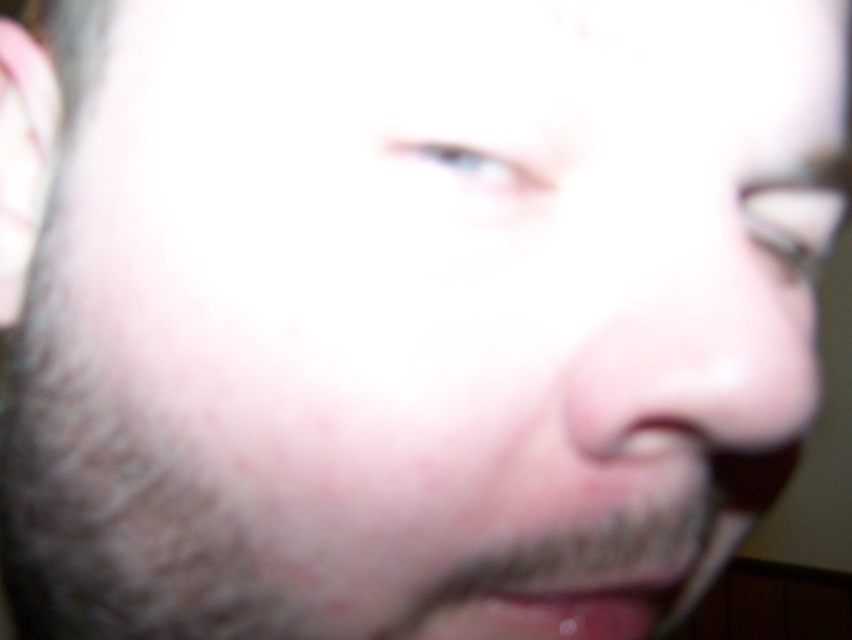
Question: Does pink smooth nose at center appear over pink glossy lips at lower center?

Choices:
 (A) no
 (B) yes

Answer: (B)

Question: Can you confirm if pink smooth nose at center is bigger than pink glossy lips at lower center?

Choices:
 (A) no
 (B) yes

Answer: (B)

Question: Is pink smooth nose at center positioned in front of pink glossy lips at lower center?

Choices:
 (A) yes
 (B) no

Answer: (A)